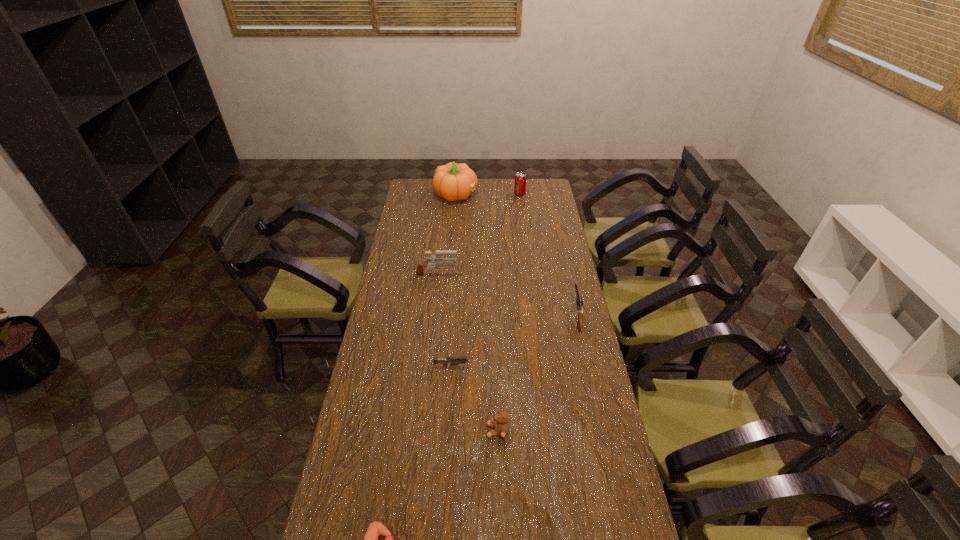
Identify the location of the tallest object. (453, 181).

The width and height of the screenshot is (960, 540). Find the location of `the farthest gun`. the farthest gun is located at coordinates (439, 260).

The image size is (960, 540). I want to click on the tallest gun, so click(439, 260).

You are a GUI agent. You are given a task and a screenshot of the screen. Output one action in this format:
    pyautogui.click(x=<x>, y=<y>)
    Task: Click on the soda can
    This screenshot has width=960, height=540.
    Given the screenshot: What is the action you would take?
    520,178

This screenshot has height=540, width=960. What are the coordinates of `the rightmost object` in the screenshot? It's located at (579, 302).

This screenshot has width=960, height=540. Identify the location of the second tallest gun. (579, 302).

What are the coordinates of `the second nearest object` in the screenshot? It's located at (501, 426).

Find the location of `teddy bear`. teddy bear is located at coordinates click(x=501, y=426).

This screenshot has width=960, height=540. In order to click on the third nearest object in this screenshot , I will do `click(460, 359)`.

This screenshot has height=540, width=960. Identify the location of the shortest object. (460, 359).